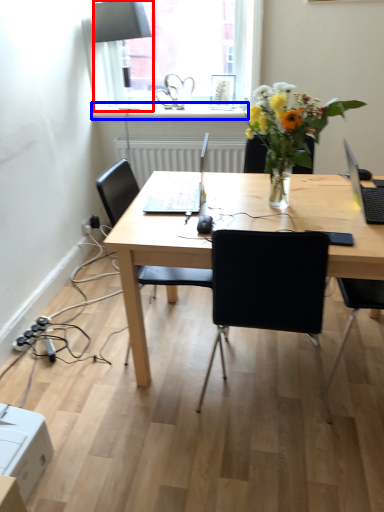
Question: Which of the following is the farthest to the observer, lamp (highlighted by a red box) or window sill (highlighted by a blue box)?

Choices:
 (A) lamp
 (B) window sill

Answer: (B)